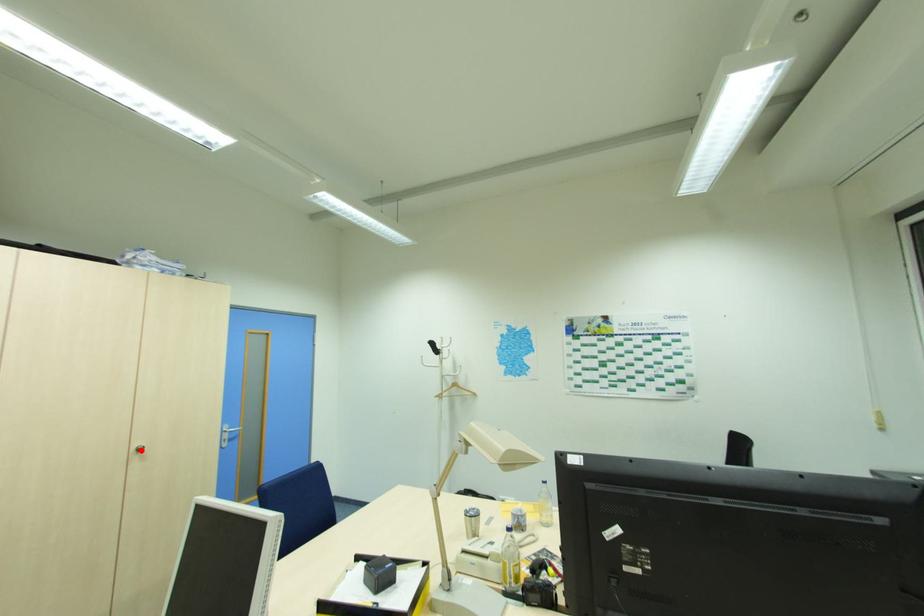
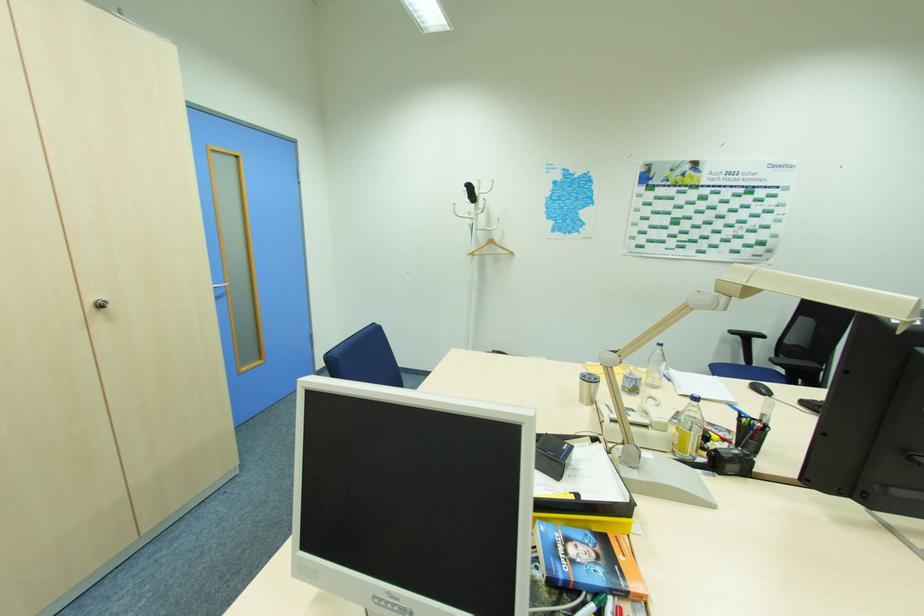
The point at the highlighted location is marked in the first image. Where is the corresponding point in the second image?

(103, 306)